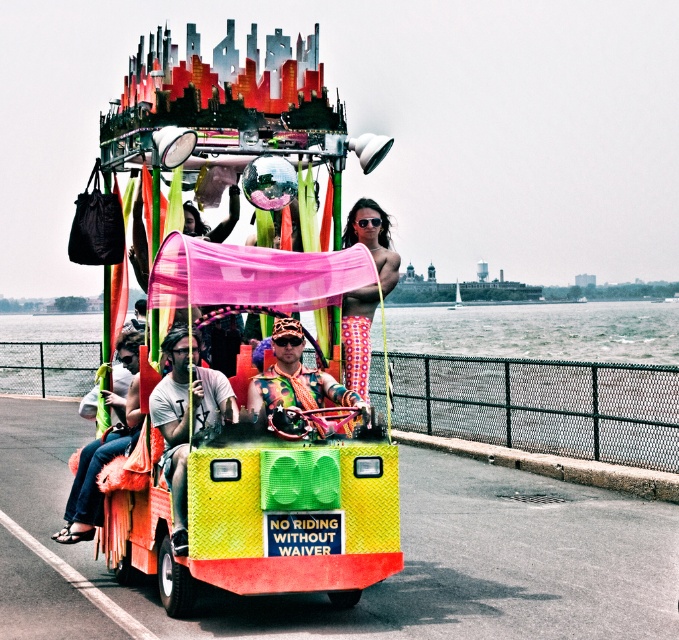
Question: Considering the relative positions of multicolored fabric at center and white sailboat at center in the image provided, where is multicolored fabric at center located with respect to white sailboat at center?

Choices:
 (A) left
 (B) right

Answer: (A)

Question: Which of the following is the farthest from the observer?

Choices:
 (A) matte white t-shirt at center
 (B) multicolored fabric at center
 (C) translucent plastic water at lower center

Answer: (C)

Question: Which of the following is the farthest from the observer?

Choices:
 (A) [458, 292]
 (B) [348, 435]
 (C) [354, 356]

Answer: (A)

Question: In this image, where is matte white t-shirt at center located relative to multicolored fabric pants at center?

Choices:
 (A) left
 (B) right

Answer: (A)

Question: Is translucent plastic water at lower center to the left of matte white t-shirt at center from the viewer's perspective?

Choices:
 (A) no
 (B) yes

Answer: (B)

Question: Which object is positioned closest to the multicolored fabric pants at center?

Choices:
 (A) matte white t-shirt at center
 (B) multicolored fabric at center
 (C) denim pants at lower left
 (D) white sailboat at center

Answer: (B)